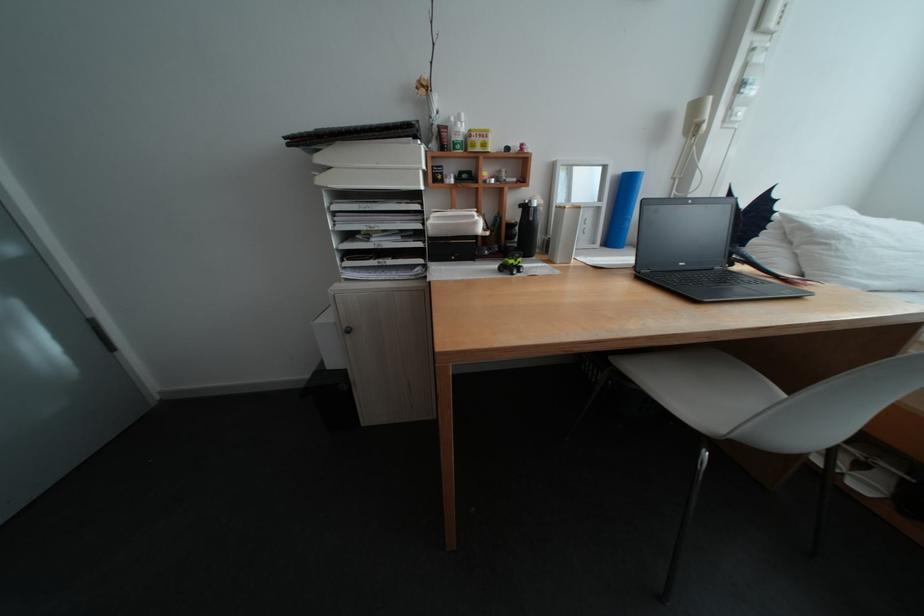
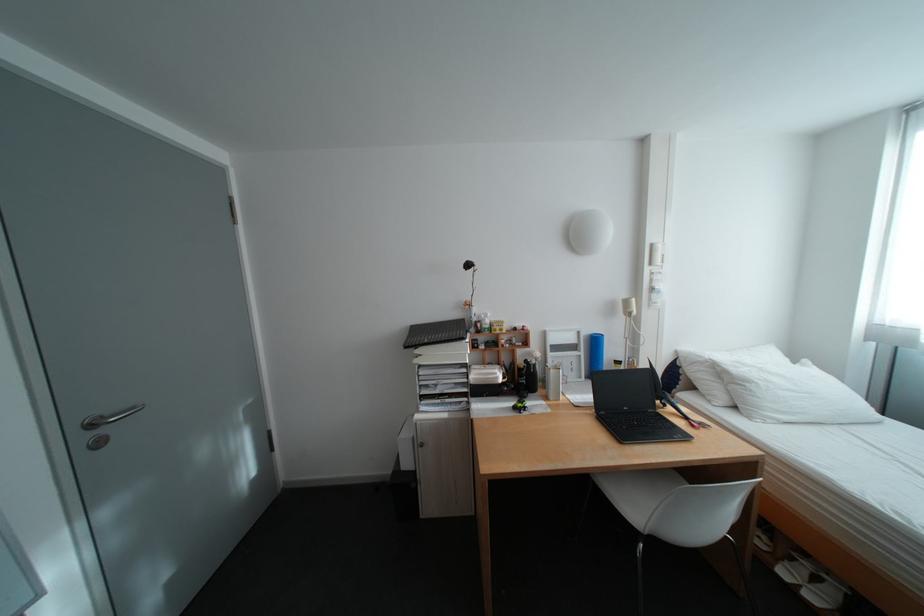
The point at (434,193) is marked in the first image. Where is the corresponding point in the second image?

(480, 363)